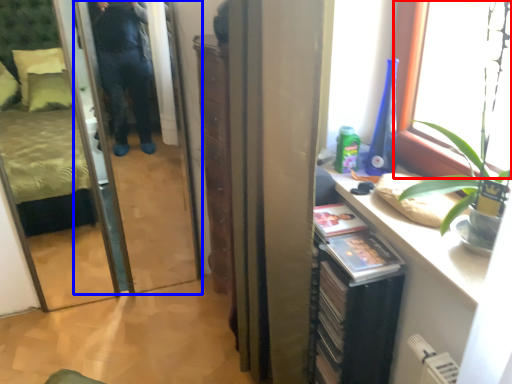
Question: Which object appears farthest to the camera in this image, window (highlighted by a red box) or screen door (highlighted by a blue box)?

Choices:
 (A) window
 (B) screen door

Answer: (B)